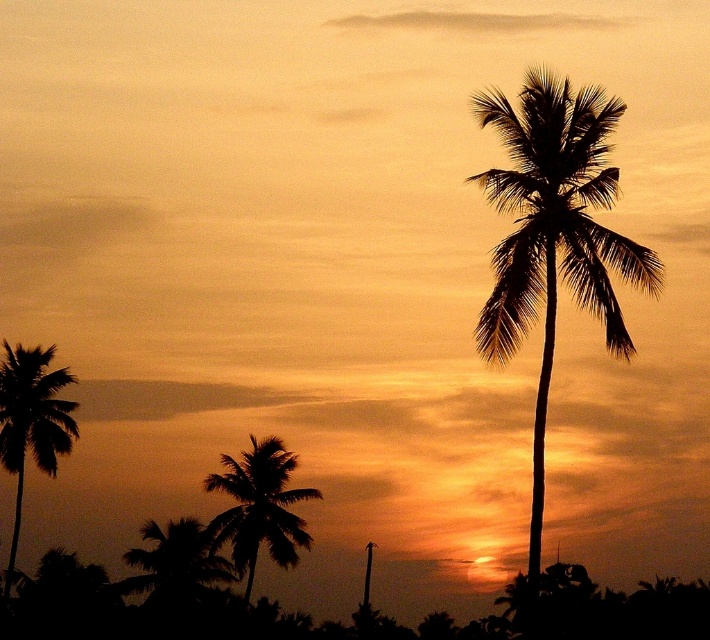
Question: Does silhouette palm at right have a greater width compared to silhouette palm tree at left?

Choices:
 (A) yes
 (B) no

Answer: (A)

Question: Estimate the real-world distances between objects in this image. Which object is farther from the silhouette palm at right?

Choices:
 (A) silhouette palm tree at left
 (B) silhouette leafy palm at lower center

Answer: (A)

Question: Does silhouette palm at right appear under silhouette palm tree at left?

Choices:
 (A) no
 (B) yes

Answer: (A)

Question: Which point is closer to the camera taking this photo?

Choices:
 (A) pyautogui.click(x=9, y=356)
 (B) pyautogui.click(x=545, y=90)

Answer: (B)

Question: Is silhouette palm at right further to camera compared to silhouette palm tree at left?

Choices:
 (A) yes
 (B) no

Answer: (B)

Question: Which object is closer to the camera taking this photo?

Choices:
 (A) silhouette leafy palm at lower center
 (B) silhouette palm tree at left
 (C) silhouette palm at right

Answer: (C)